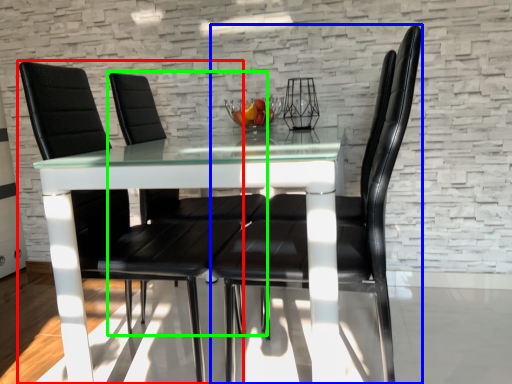
Question: Estimate the real-world distances between objects in this image. Which object is closer to chair (highlighted by a red box), chair (highlighted by a blue box) or chair (highlighted by a green box)?

Choices:
 (A) chair
 (B) chair

Answer: (B)